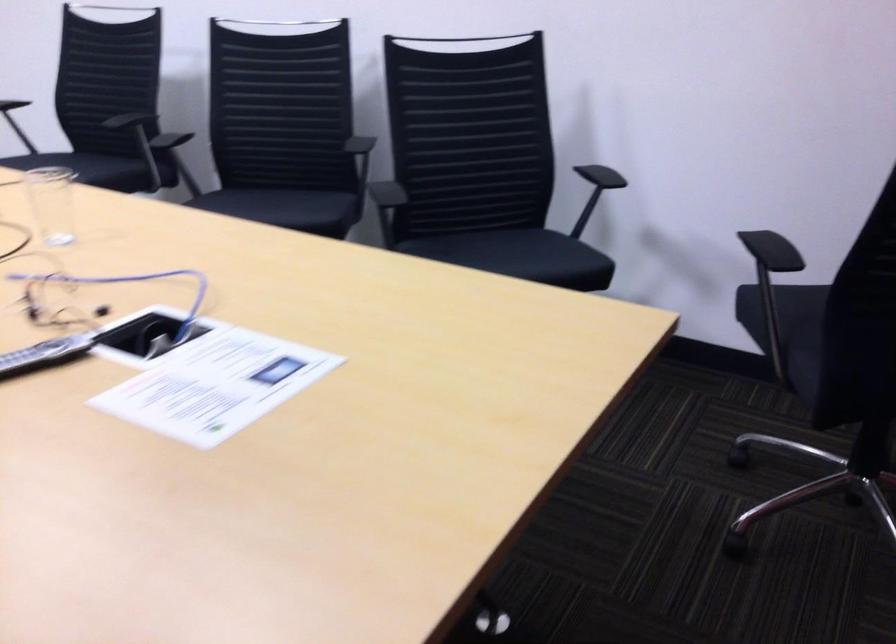
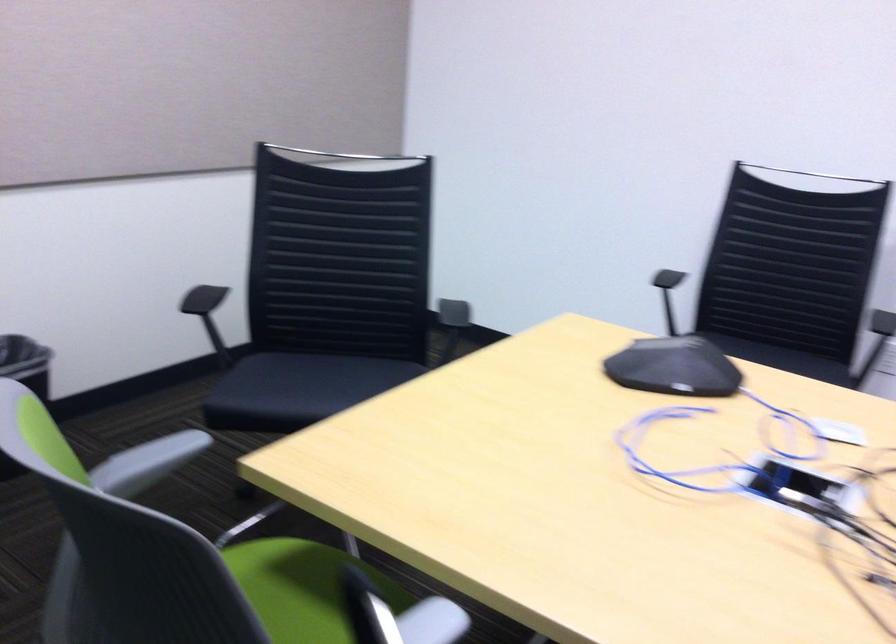
Question: Which direction would the cameraman need to move to produce the second image? Reply with the corresponding letter.

Choices:
 (A) Left
 (B) Right
 (C) Forward
 (D) Backward

Answer: (A)